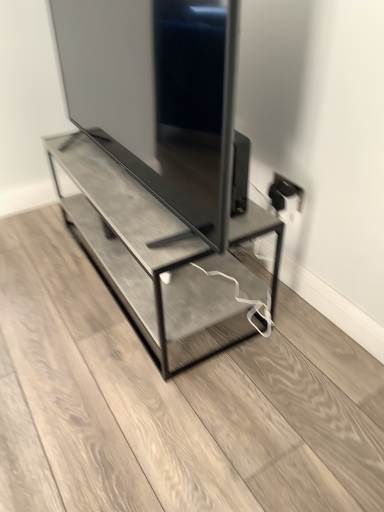
Question: Should I look upward or downward to see white plastic electric outlet at upper right?

Choices:
 (A) down
 (B) up

Answer: (B)